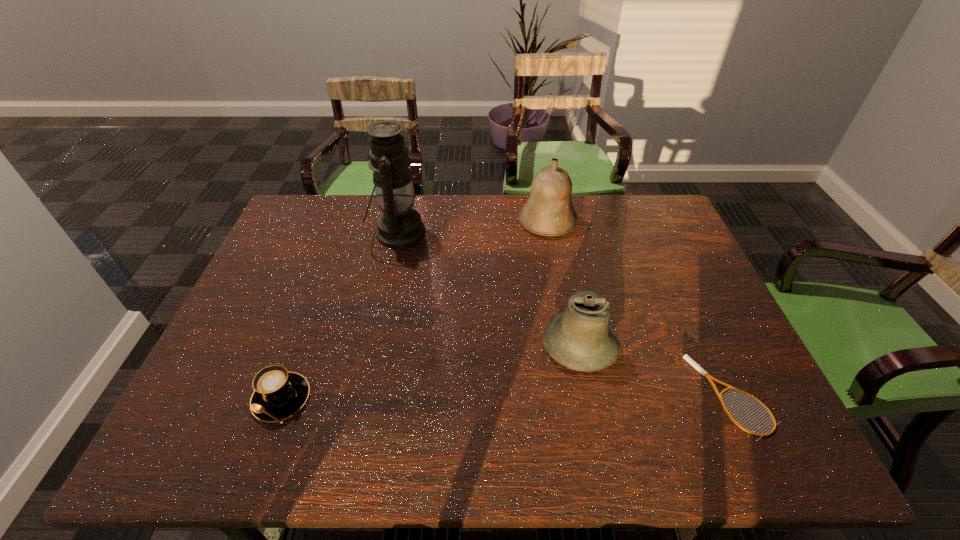
Locate an element on the screen. This screenshot has width=960, height=540. blank space located on the front of the tallest object is located at coordinates (371, 361).

Find the location of `vacant area located 0.390m on the front of the taller bell`. vacant area located 0.390m on the front of the taller bell is located at coordinates (568, 336).

Where is `vacant position located on the back of the shorter bell`? Image resolution: width=960 pixels, height=540 pixels. vacant position located on the back of the shorter bell is located at coordinates click(569, 293).

At what (x,y) coordinates should I click in order to perform the action: click on free spot located on the back of the cappuccino. Please return your answer as a coordinate pair (x, y). Looking at the image, I should click on (325, 278).

What are the coordinates of `vacant position located 0.190m on the left of the rightmost object` in the screenshot? It's located at (613, 396).

This screenshot has width=960, height=540. I want to click on oil lamp located at the far edge, so click(399, 226).

At what (x,y) coordinates should I click in order to perform the action: click on bell that is at the far edge. Please return your answer as a coordinate pair (x, y). Looking at the image, I should click on (548, 211).

The image size is (960, 540). In order to click on cappuccino present at the near edge in this screenshot , I will do `click(278, 394)`.

The width and height of the screenshot is (960, 540). What are the coordinates of `tennis racket situated at the near edge` in the screenshot? It's located at (686, 357).

Find the location of a particular element. This screenshot has height=540, width=960. object that is at the left edge is located at coordinates (278, 394).